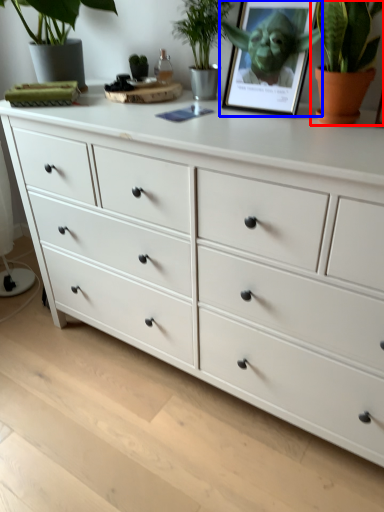
Question: Which point is closer to the camera, houseplant (highlighted by a red box) or picture frame (highlighted by a blue box)?

Choices:
 (A) houseplant
 (B) picture frame

Answer: (A)